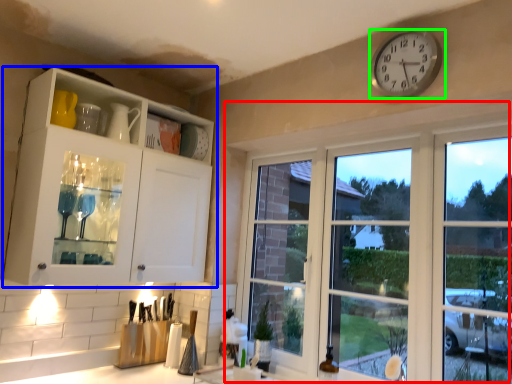
Question: Based on their relative distances, which object is nearer to window (highlighted by a red box)? Choose from cabinetry (highlighted by a blue box) and wall clock (highlighted by a green box).

Choices:
 (A) cabinetry
 (B) wall clock

Answer: (B)